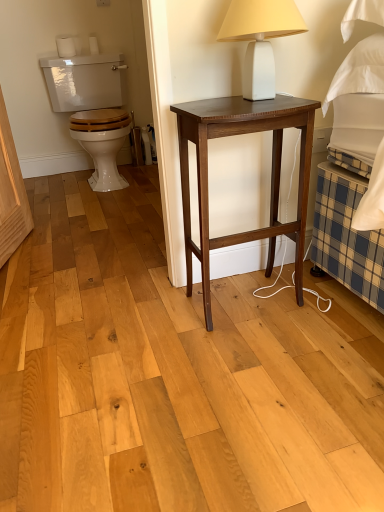
Measure the distance between white matte toilet paper at upper left, positioned as the first toilet paper in left-to-right order, and camera.

A distance of 2.70 meters exists between white matte toilet paper at upper left, positioned as the first toilet paper in left-to-right order, and camera.

What do you see at coordinates (65, 47) in the screenshot? I see `white matte toilet paper at upper left, which is the 2th toilet paper in right-to-left order` at bounding box center [65, 47].

Where is `white matte table lamp at upper center`? The width and height of the screenshot is (384, 512). white matte table lamp at upper center is located at coordinates [260, 39].

Where is `white glossy toilet at left`? This screenshot has width=384, height=512. white glossy toilet at left is located at coordinates (92, 109).

You are a GUI agent. You are given a task and a screenshot of the screen. Output one action in this format:
    pyautogui.click(x=<x>, y=<y>)
    Task: Click on the white matte toilet paper at upper left, which is the 2th toilet paper in right-to-left order
    
    Given the screenshot: What is the action you would take?
    pyautogui.click(x=65, y=47)

How different are the orientations of white matte toilet paper at upper left, which ranks as the 1th toilet paper in right-to-left order, and white glossy toilet at left in degrees?

0.879 degrees separate the facing orientations of white matte toilet paper at upper left, which ranks as the 1th toilet paper in right-to-left order, and white glossy toilet at left.

Considering the relative positions of white matte toilet paper at upper left, which ranks as the 1th toilet paper in right-to-left order, and white glossy toilet at left in the image provided, is white matte toilet paper at upper left, which ranks as the 1th toilet paper in right-to-left order, behind white glossy toilet at left?

Yes, it is behind white glossy toilet at left.

From the picture: Are white matte toilet paper at upper left, the second toilet paper from the left, and white glossy toilet at left far apart?

white matte toilet paper at upper left, the second toilet paper from the left, is actually quite close to white glossy toilet at left.

Between white matte toilet paper at upper left, which ranks as the 1th toilet paper in right-to-left order, and white glossy toilet at left, which one has less height?

Standing shorter between the two is white matte toilet paper at upper left, which ranks as the 1th toilet paper in right-to-left order.

Could you measure the distance between white matte toilet paper at upper left, which is the 2th toilet paper in right-to-left order, and white matte table lamp at upper center?

white matte toilet paper at upper left, which is the 2th toilet paper in right-to-left order, is 1.99 meters from white matte table lamp at upper center.

Can you confirm if white matte toilet paper at upper left, positioned as the first toilet paper in left-to-right order, is shorter than white matte table lamp at upper center?

Indeed, white matte toilet paper at upper left, positioned as the first toilet paper in left-to-right order, has a lesser height compared to white matte table lamp at upper center.

Between white matte toilet paper at upper left, positioned as the first toilet paper in left-to-right order, and white matte table lamp at upper center, which one has larger width?

With larger width is white matte table lamp at upper center.

From the image's perspective, between white matte toilet paper at upper left, positioned as the first toilet paper in left-to-right order, and white matte table lamp at upper center, which one is located above?

white matte toilet paper at upper left, positioned as the first toilet paper in left-to-right order, appears higher in the image.

From a real-world perspective, which object rests below the other?

In real-world perspective, dark wood nightstand at center is lower.

Consider the image. Is white glossy toilet at left not inside dark wood nightstand at center?

Yes, white glossy toilet at left is located beyond the bounds of dark wood nightstand at center.

What's the angular difference between white glossy toilet at left and dark wood nightstand at center's facing directions?

They differ by 0.454 degrees in their facing directions.

Can you confirm if white glossy toilet at left is positioned to the right of dark wood nightstand at center?

In fact, white glossy toilet at left is to the left of dark wood nightstand at center.

What's the angular difference between white matte toilet paper at upper left, which is the 2th toilet paper in right-to-left order, and white matte toilet paper at upper left, which ranks as the 1th toilet paper in right-to-left order,'s facing directions?

The angle between the facing direction of white matte toilet paper at upper left, which is the 2th toilet paper in right-to-left order, and the facing direction of white matte toilet paper at upper left, which ranks as the 1th toilet paper in right-to-left order, is 0 degrees.

From the image's perspective, is white matte toilet paper at upper left, which is the 2th toilet paper in right-to-left order, under white matte toilet paper at upper left, the second toilet paper from the left?

Correct, white matte toilet paper at upper left, which is the 2th toilet paper in right-to-left order, appears lower than white matte toilet paper at upper left, the second toilet paper from the left, in the image.

Which object is closer to the camera taking this photo, white matte toilet paper at upper left, positioned as the first toilet paper in left-to-right order, or white matte toilet paper at upper left, the second toilet paper from the left?

white matte toilet paper at upper left, positioned as the first toilet paper in left-to-right order, is in front.

Can you confirm if white matte toilet paper at upper left, which is the 2th toilet paper in right-to-left order, is wider than white matte toilet paper at upper left, the second toilet paper from the left?

No.

From the image's perspective, which one is positioned lower, white glossy toilet at left or white matte toilet paper at upper left, the second toilet paper from the left?

white glossy toilet at left, from the image's perspective.

Would you say white glossy toilet at left is outside white matte toilet paper at upper left, which ranks as the 1th toilet paper in right-to-left order?

white glossy toilet at left lies outside white matte toilet paper at upper left, which ranks as the 1th toilet paper in right-to-left order,'s area.

Does white glossy toilet at left turn towards white matte toilet paper at upper left, the second toilet paper from the left?

No, white glossy toilet at left does not turn towards white matte toilet paper at upper left, the second toilet paper from the left.

Does white glossy toilet at left appear on the left side of white matte toilet paper at upper left, positioned as the first toilet paper in left-to-right order?

Incorrect, white glossy toilet at left is not on the left side of white matte toilet paper at upper left, positioned as the first toilet paper in left-to-right order.

Is point (101, 165) farther from camera compared to point (70, 49)?

No, it is in front of (70, 49).

From the white glossy toilet at left, count the 2nd toilet paper to the left and point to it. Please provide its 2D coordinates.

[(65, 47)]

Which object is closer to the camera taking this photo, white glossy toilet at left or white matte toilet paper at upper left, positioned as the first toilet paper in left-to-right order?

white glossy toilet at left is closer to the camera.

Can you confirm if white matte toilet paper at upper left, positioned as the first toilet paper in left-to-right order, is shorter than white glossy toilet at left?

Correct, white matte toilet paper at upper left, positioned as the first toilet paper in left-to-right order, is not as tall as white glossy toilet at left.

From the image's perspective, is white matte toilet paper at upper left, which is the 2th toilet paper in right-to-left order, positioned above or below white glossy toilet at left?

Based on their image positions, white matte toilet paper at upper left, which is the 2th toilet paper in right-to-left order, is located above white glossy toilet at left.

In the scene shown: Considering the sizes of white matte toilet paper at upper left, which is the 2th toilet paper in right-to-left order, and white glossy toilet at left in the image, is white matte toilet paper at upper left, which is the 2th toilet paper in right-to-left order, bigger or smaller than white glossy toilet at left?

In the image, white matte toilet paper at upper left, which is the 2th toilet paper in right-to-left order, appears to be smaller than white glossy toilet at left.

In the scene shown: Is white matte toilet paper at upper left, positioned as the first toilet paper in left-to-right order, turned away from white glossy toilet at left?

No, white matte toilet paper at upper left, positioned as the first toilet paper in left-to-right order, is not facing away from white glossy toilet at left.

Find the location of a particular element. armchair that appears below the white matte toilet paper at upper left, which ranks as the 1th toilet paper in right-to-left order (from the image's perspective) is located at coordinates (92, 109).

Locate an element on the screen. The width and height of the screenshot is (384, 512). the 2nd toilet paper to the left when counting from the white matte table lamp at upper center is located at coordinates (65, 47).

Consider the image. Looking at the image, which one is located further to dark wood nightstand at center, white matte toilet paper at upper left, the second toilet paper from the left, or white glossy toilet at left?

white matte toilet paper at upper left, the second toilet paper from the left, lies further to dark wood nightstand at center than the other object.

Based on the photo, from the image, which object appears to be farther from white glossy toilet at left, dark wood nightstand at center or white matte toilet paper at upper left, which is the 2th toilet paper in right-to-left order?

dark wood nightstand at center is positioned further to the anchor white glossy toilet at left.

From the image, which object appears to be nearer to white matte toilet paper at upper left, which is the 2th toilet paper in right-to-left order, white glossy toilet at left or white matte toilet paper at upper left, which ranks as the 1th toilet paper in right-to-left order?

white matte toilet paper at upper left, which ranks as the 1th toilet paper in right-to-left order.

From the image, which object appears to be nearer to white matte toilet paper at upper left, which is the 2th toilet paper in right-to-left order, white matte table lamp at upper center or white matte toilet paper at upper left, the second toilet paper from the left?

white matte toilet paper at upper left, the second toilet paper from the left.

Estimate the real-world distances between objects in this image. Which object is closer to white glossy toilet at left, white matte toilet paper at upper left, positioned as the first toilet paper in left-to-right order, or white matte table lamp at upper center?

white matte toilet paper at upper left, positioned as the first toilet paper in left-to-right order.

From the image, which object appears to be nearer to white matte toilet paper at upper left, positioned as the first toilet paper in left-to-right order, dark wood nightstand at center or white glossy toilet at left?

The object closer to white matte toilet paper at upper left, positioned as the first toilet paper in left-to-right order, is white glossy toilet at left.

Based on their spatial positions, is white matte toilet paper at upper left, positioned as the first toilet paper in left-to-right order, or white matte table lamp at upper center closer to white matte toilet paper at upper left, which ranks as the 1th toilet paper in right-to-left order?

white matte toilet paper at upper left, positioned as the first toilet paper in left-to-right order, is positioned closer to the anchor white matte toilet paper at upper left, which ranks as the 1th toilet paper in right-to-left order.

Estimate the real-world distances between objects in this image. Which object is closer to dark wood nightstand at center, white glossy toilet at left or white matte toilet paper at upper left, the second toilet paper from the left?

The object closer to dark wood nightstand at center is white glossy toilet at left.

Locate an element on the screen. The image size is (384, 512). nightstand between white matte table lamp at upper center and white glossy toilet at left along the z-axis is located at coordinates (271, 174).

Find the location of a particular element. This screenshot has width=384, height=512. nightstand located between white matte table lamp at upper center and white matte toilet paper at upper left, which ranks as the 1th toilet paper in right-to-left order, in the depth direction is located at coordinates (271, 174).

You are a GUI agent. You are given a task and a screenshot of the screen. Output one action in this format:
    pyautogui.click(x=<x>, y=<y>)
    Task: Click on the nightstand between white matte table lamp at upper center and white matte toilet paper at upper left, positioned as the first toilet paper in left-to-right order, from front to back
    The width and height of the screenshot is (384, 512).
    Given the screenshot: What is the action you would take?
    pyautogui.click(x=271, y=174)

Identify the location of armchair positioned between dark wood nightstand at center and white matte toilet paper at upper left, which is the 2th toilet paper in right-to-left order, from near to far. (92, 109).